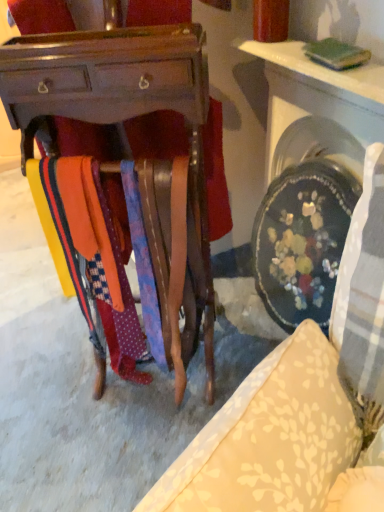
At what (x,y) coordinates should I click in order to perform the action: click on vacant area that lies in front of polka dot fabric tie at center. Please return your answer as a coordinate pair (x, y). The height and width of the screenshot is (512, 384). Looking at the image, I should click on (152, 420).